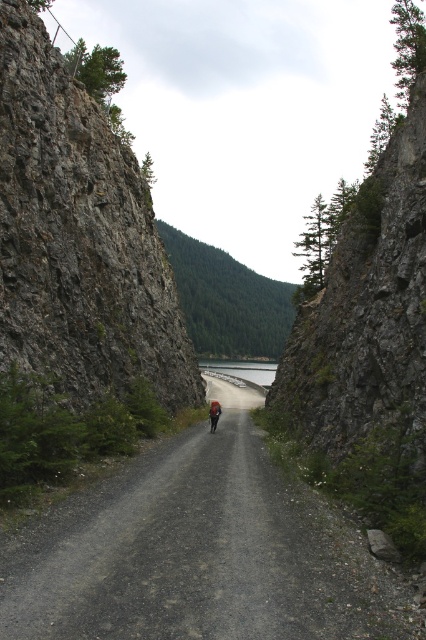
You are a drone operator trying to capture a photo of the gray concrete dam at center and the green forested mountain at center from above. Which object will appear wider in the photo?

The green forested mountain at center will appear wider in the photo because its width is larger than the gray concrete dam at center.